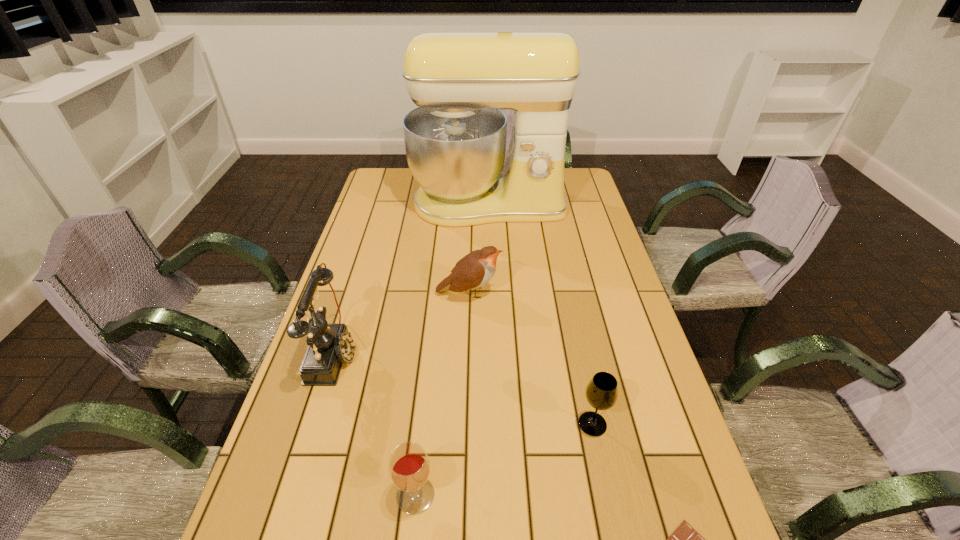
Where is `vacant area at the right edge`? This screenshot has height=540, width=960. vacant area at the right edge is located at coordinates [624, 307].

In the image, there is a desktop. What are the coordinates of `vacant space at the far left corner` in the screenshot? It's located at (392, 176).

The image size is (960, 540). In the image, there is a desktop. Identify the location of free space at the far right corner. (589, 197).

Locate an element on the screen. The height and width of the screenshot is (540, 960). blank region between the bird and the mixer is located at coordinates (479, 248).

This screenshot has height=540, width=960. Find the location of `vacant area that lies between the second nearest object and the leftmost object`. vacant area that lies between the second nearest object and the leftmost object is located at coordinates (375, 424).

Identify the location of free space between the second farthest object and the farther wineglass. (x=531, y=358).

At what (x,y) coordinates should I click in order to perform the action: click on free spot between the right wineglass and the telephone. Please return your answer as a coordinate pair (x, y). The image size is (960, 540). Looking at the image, I should click on (464, 388).

The width and height of the screenshot is (960, 540). What are the coordinates of `vacant space in between the second tallest object and the second nearest object` in the screenshot? It's located at (375, 424).

This screenshot has height=540, width=960. In order to click on object that is the closest to the farthest object in this screenshot , I will do `click(476, 269)`.

Identify the location of object that stands as the fifth closest to the left wineglass. Image resolution: width=960 pixels, height=540 pixels. (455, 141).